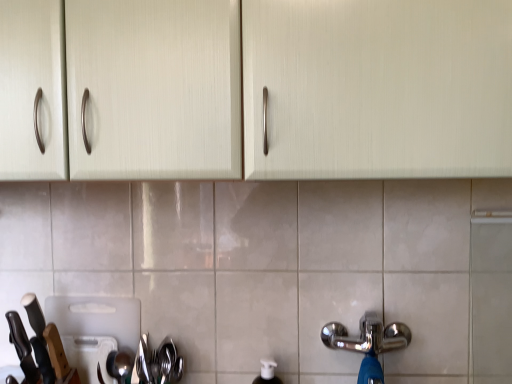
Question: Choose the correct answer: Is chrome metallic tap at lower right inside white plastic cutting board at lower left, the second appliance when ordered from front to back, or outside it?

Choices:
 (A) outside
 (B) inside

Answer: (A)

Question: In terms of height, does chrome metallic tap at lower right look taller or shorter compared to white plastic cutting board at lower left, acting as the first appliance starting from the back?

Choices:
 (A) short
 (B) tall

Answer: (A)

Question: Which of these objects is positioned closest to the black leather knife at lower left, acting as the second knife starting from the right?

Choices:
 (A) shiny metallic spoon at lower left
 (B) white plastic cutting board at lower left, the second appliance when ordered from front to back
 (C) black matte knife at left, the 1th knife from the right
 (D) matte cream cabinet at upper center
 (E) chrome metallic tap at lower right

Answer: (C)

Question: Estimate the real-world distances between objects in this image. Which object is farther from the shiny metallic spoon at lower left?

Choices:
 (A) white plastic cutting board at lower left, acting as the first appliance starting from the back
 (B) chrome metallic tap at lower right
 (C) satin silver spoon at lower left, positioned as the second appliance in back-to-front order
 (D) matte cream cabinet at upper center
 (E) black matte knife at left, positioned as the 2th knife in left-to-right order

Answer: (D)